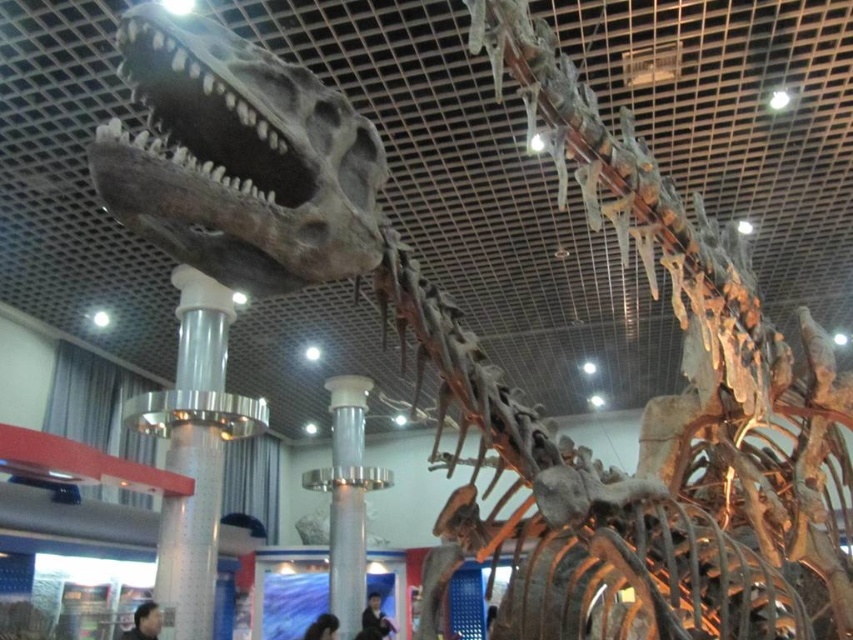
You are standing in the museum and want to take a photo of the dinosaur skeleton. You notice two points marked on the floor at coordinates point (190, 625) and point (350, 486). Which point should you stand at to ensure the dinosaur skeleton is fully visible in your photo?

You should stand at point (190, 625) because it is in front of point (350, 486), providing a clearer view of the dinosaur skeleton.

You are a visitor in the museum and want to take a photo of the dinosaur skeleton. There are two silver metallic columns in front of you. One is labeled as a column and the other as a pillar. Which one is taller? Please choose between the silver metallic column at center and the silver metallic pillar at center.

The silver metallic column at center is taller than the silver metallic pillar at center, so you should choose the silver metallic column at center as the taller one.

You are standing in the museum and see the silver metallic column at center and the silver metallic pillar at center. Which one is positioned to the left?

The silver metallic column at center is positioned to the left of the silver metallic pillar at center.